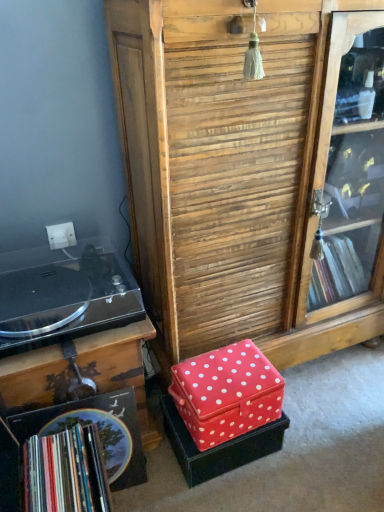
The width and height of the screenshot is (384, 512). In order to click on space that is in front of red fabric box at center, the first storage box positioned from the bottom in this screenshot , I will do `click(236, 495)`.